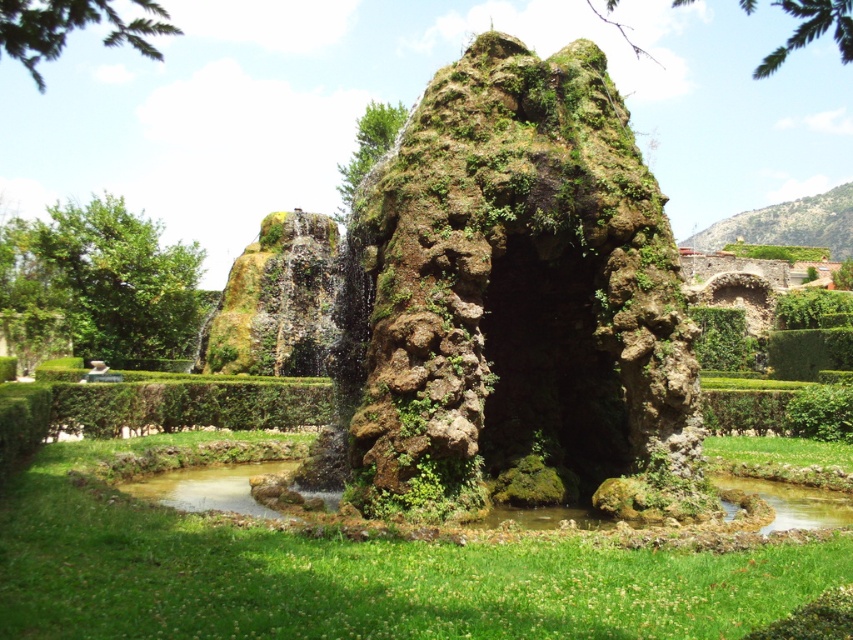
Question: Which object appears closest to the camera in this image?

Choices:
 (A) green leafy hedge at center
 (B) green leafy hedge at lower center
 (C) green leafy tree at left

Answer: (A)

Question: Does green grass at center appear on the left side of green leafy hedge at center?

Choices:
 (A) yes
 (B) no

Answer: (A)

Question: Which of the following is the farthest from the observer?

Choices:
 (A) green grass at center
 (B) green mossy rock at center

Answer: (B)

Question: Does green leafy tree at left appear on the right side of green mossy rock at upper center?

Choices:
 (A) no
 (B) yes

Answer: (A)

Question: Does green leafy tree at left appear on the left side of green mossy rock at upper center?

Choices:
 (A) yes
 (B) no

Answer: (A)

Question: Estimate the real-world distances between objects in this image. Which object is farther from the green leafy tree at upper center?

Choices:
 (A) green leafy branch at upper left
 (B) green mossy rock at upper center

Answer: (A)